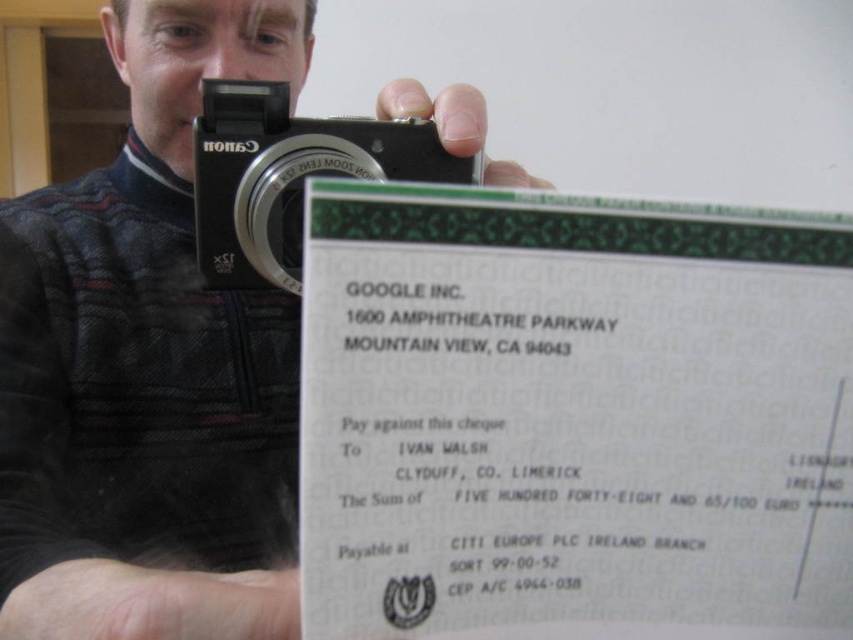
You are a photographer trying to capture a clear photo of the cheque. Based on the scene, which object should you focus on first? The white paper at center or the black matte camera at upper center?

The white paper at center is closer to the viewer than the black matte camera at upper center, so you should focus on the white paper at center first to ensure it is in clear focus.

You are a photographer trying to capture a clear image of the cheque. The white paper at center and the black matte camera at upper center are both in your viewfinder. Which object should you focus on to ensure the cheque is clearly visible in the photo?

You should focus on the white paper at center because it is the larger object and the cheque is held prominently in the foreground, making it the main subject for clear capture.